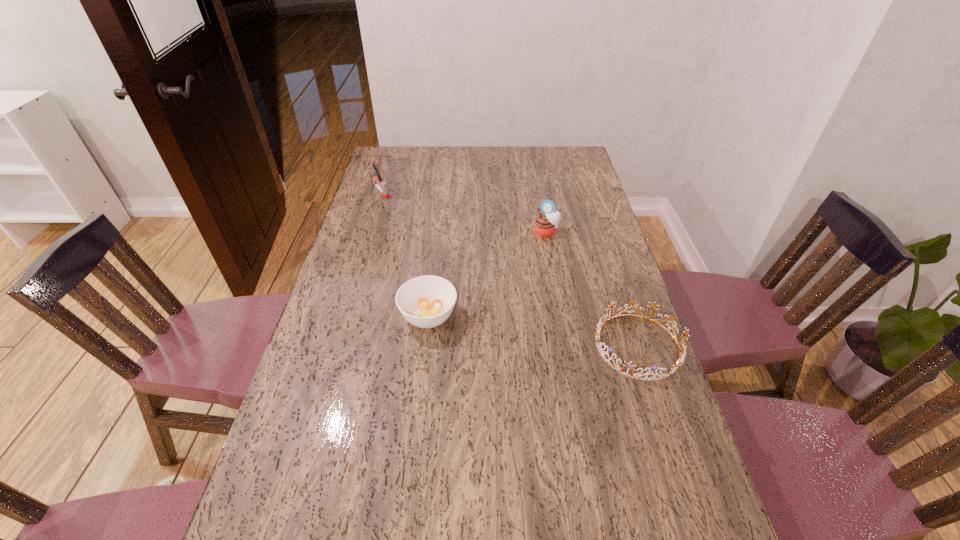
I want to click on the third object from right to left, so click(x=427, y=301).

Image resolution: width=960 pixels, height=540 pixels. I want to click on tiara, so click(680, 360).

Identify the location of the tallest object. (545, 223).

What are the coordinates of `the third object from left to right` in the screenshot? It's located at coord(545,223).

The image size is (960, 540). Identify the location of the leftmost object. (381, 185).

Locate an element on the screen. The width and height of the screenshot is (960, 540). stapler is located at coordinates (381, 185).

Locate an element on the screen. The image size is (960, 540). free spot located on the back of the soup bowl is located at coordinates (436, 248).

Find the location of a particular element. vacant region located 0.380m on the front-facing side of the tiara is located at coordinates (x=449, y=346).

Locate an element on the screen. The image size is (960, 540). vacant space positioned on the front-facing side of the tiara is located at coordinates (488, 346).

The height and width of the screenshot is (540, 960). In order to click on free spot located on the front-facing side of the tiara in this screenshot , I will do `click(570, 346)`.